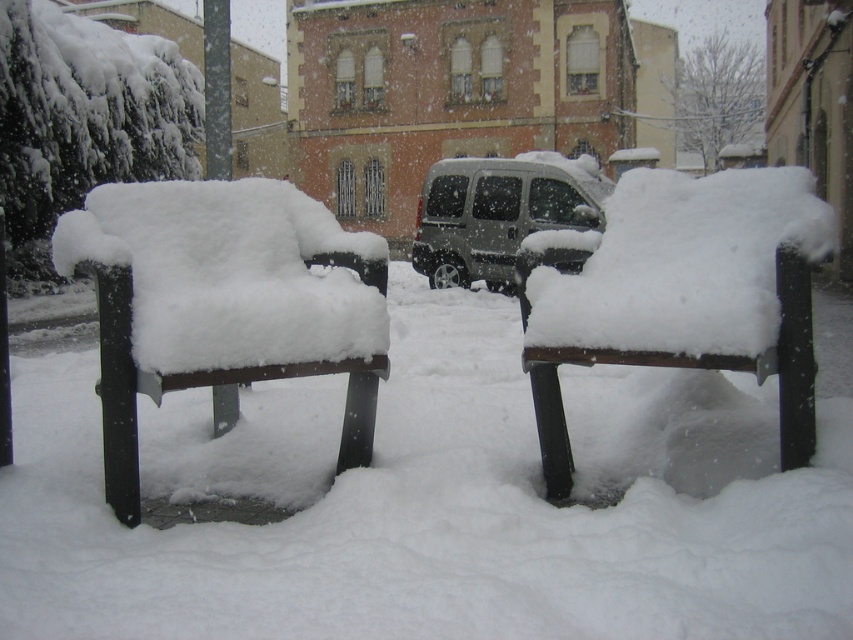
Can you confirm if wooden park bench at left is positioned above metallic silver van at center?

Actually, wooden park bench at left is below metallic silver van at center.

Does wooden park bench at left have a lesser width compared to metallic silver van at center?

Correct, wooden park bench at left's width is less than metallic silver van at center's.

Where is `wooden park bench at left`? The image size is (853, 640). wooden park bench at left is located at coordinates (222, 301).

In the scene shown: Can you confirm if wooden park bench at left is shorter than wooden park bench at center?

Yes, wooden park bench at left is shorter than wooden park bench at center.

How far apart are wooden park bench at left and wooden park bench at center?

A distance of 36.81 inches exists between wooden park bench at left and wooden park bench at center.

Find the location of `wooden park bench at left`. wooden park bench at left is located at coordinates (222, 301).

Consider the image. Can you confirm if wooden park bench at center is taller than metallic silver van at center?

No, wooden park bench at center is not taller than metallic silver van at center.

Does wooden park bench at center have a smaller size compared to metallic silver van at center?

Yes, wooden park bench at center is smaller than metallic silver van at center.

Between point (555, 266) and point (558, 224), which one is positioned behind?

Positioned behind is point (558, 224).

Locate an element on the screen. The height and width of the screenshot is (640, 853). wooden park bench at center is located at coordinates (680, 292).